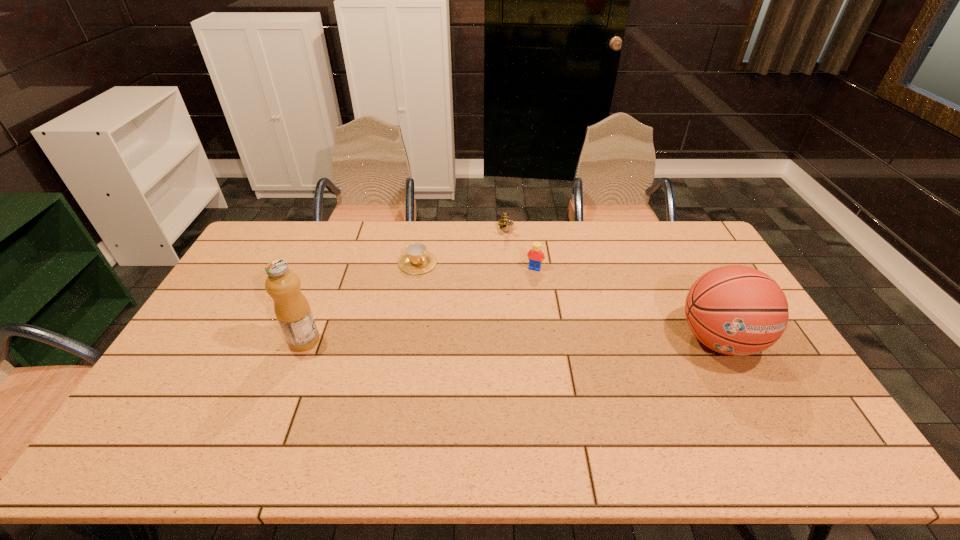
Choose which object is the fourth nearest neighbor to the third object from left to right. Please provide its 2D coordinates. Your answer should be formatted as a tuple, i.e. [(x, y)], where the tuple contains the x and y coordinates of a point satisfying the conditions above.

[(291, 307)]

This screenshot has width=960, height=540. In order to click on vacant space that satisfies the following two spatial constraints: 1. on the front side of the fourth object from right to left; 2. on the left side of the fourth object from left to right in this screenshot , I will do pos(417,268).